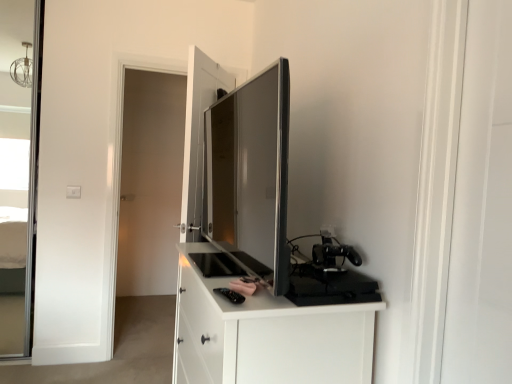
Question: Considering the relative sizes of matte black tv at center, which is the first appliance from left to right, and white glossy screen door at right, the 2th screen door in the back-to-front sequence, in the image provided, is matte black tv at center, which is the first appliance from left to right, wider than white glossy screen door at right, the 2th screen door in the back-to-front sequence,?

Choices:
 (A) no
 (B) yes

Answer: (B)

Question: Is matte black tv at center, which is counted as the 1th appliance, starting from the top, facing towards white glossy screen door at right, which is counted as the first screen door, starting from the right?

Choices:
 (A) yes
 (B) no

Answer: (B)

Question: Is matte black tv at center, the second appliance when ordered from bottom to top, located outside white glossy screen door at right, positioned as the 2th screen door in left-to-right order?

Choices:
 (A) no
 (B) yes

Answer: (B)

Question: From the image's perspective, is matte black tv at center, the second appliance when ordered from bottom to top, on white glossy screen door at right, the 2th screen door in the back-to-front sequence?

Choices:
 (A) no
 (B) yes

Answer: (B)

Question: Are matte black tv at center, the second appliance when ordered from bottom to top, and white glossy screen door at right, the 2th screen door in the back-to-front sequence, located far from each other?

Choices:
 (A) yes
 (B) no

Answer: (B)

Question: From a real-world perspective, is matte black tv at center, the second appliance when ordered from bottom to top, on white glossy screen door at right, which is counted as the first screen door, starting from the right?

Choices:
 (A) no
 (B) yes

Answer: (B)

Question: Is black matte gaming console at right, the second appliance positioned from the top, not within white glossy screen door at right, the 2th screen door in the back-to-front sequence?

Choices:
 (A) no
 (B) yes

Answer: (B)

Question: Is black matte gaming console at right, the second appliance positioned from the top, at the right side of white glossy screen door at right, which is counted as the first screen door, starting from the right?

Choices:
 (A) no
 (B) yes

Answer: (A)

Question: From the image's perspective, is black matte gaming console at right, the second appliance positioned from the top, on top of white glossy screen door at right, positioned as the 2th screen door in left-to-right order?

Choices:
 (A) no
 (B) yes

Answer: (A)

Question: Considering the relative positions of black matte gaming console at right, arranged as the 1th appliance when ordered from the bottom, and white glossy screen door at right, positioned as the 2th screen door in left-to-right order, in the image provided, is black matte gaming console at right, arranged as the 1th appliance when ordered from the bottom, in front of white glossy screen door at right, positioned as the 2th screen door in left-to-right order,?

Choices:
 (A) yes
 (B) no

Answer: (B)

Question: Is black matte gaming console at right, the 1th appliance viewed from the right, facing towards white glossy screen door at right, which is counted as the first screen door, starting from the right?

Choices:
 (A) yes
 (B) no

Answer: (B)

Question: Can you confirm if black matte gaming console at right, the second appliance positioned from the top, is positioned to the left of white glossy screen door at right, the 2th screen door in the back-to-front sequence?

Choices:
 (A) yes
 (B) no

Answer: (A)

Question: Does transparent glass door at left, the second screen door in the front-to-back sequence, lie behind black matte gaming console at right, the second appliance positioned from the top?

Choices:
 (A) yes
 (B) no

Answer: (A)